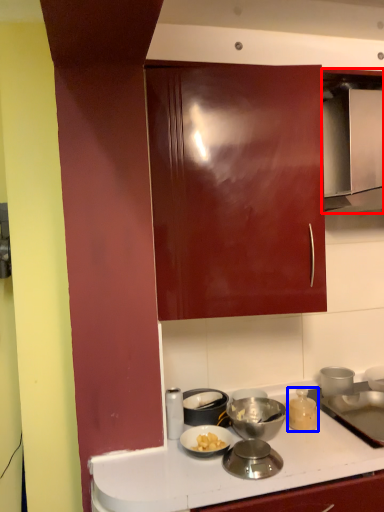
Question: Which object is closer to the camera taking this photo, home appliance (highlighted by a red box) or kitchen appliance (highlighted by a blue box)?

Choices:
 (A) home appliance
 (B) kitchen appliance

Answer: (A)